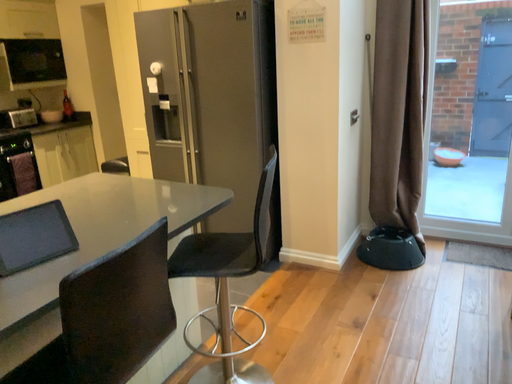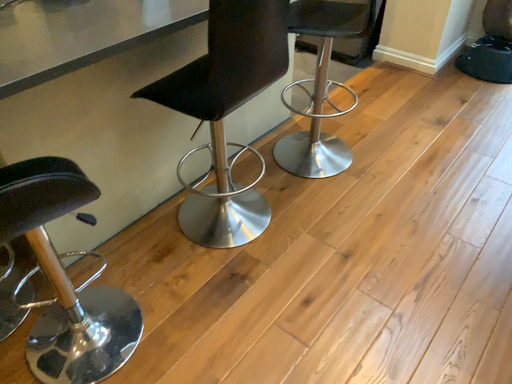
Question: Which way did the camera rotate in the video?

Choices:
 (A) rotated downward
 (B) rotated upward

Answer: (A)